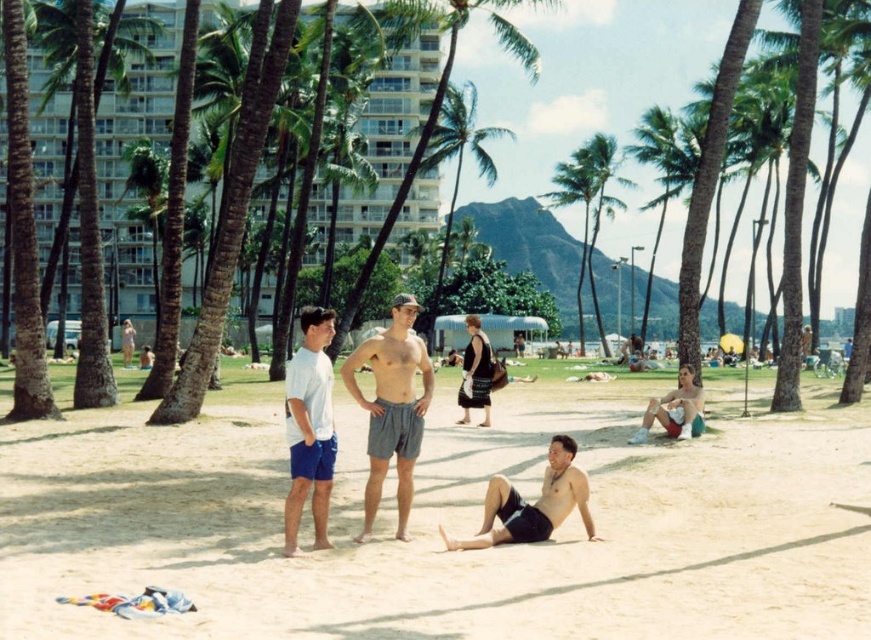
Question: Can you confirm if light brown sand at center is positioned below matte black shorts at lower center?

Choices:
 (A) yes
 (B) no

Answer: (A)

Question: Can you confirm if green leafy palm tree at center is positioned to the left of beige shorts at lower right?

Choices:
 (A) no
 (B) yes

Answer: (A)

Question: Estimate the real-world distances between objects in this image. Which object is farther from the matte black shorts at lower center?

Choices:
 (A) green leafy palm tree at center
 (B) beige shorts at lower right
 (C) gray cotton shorts at center
 (D) white cotton t-shirt at center

Answer: (A)

Question: Which point is closer to the camera?

Choices:
 (A) light brown sand at center
 (B) white cotton t-shirt at center

Answer: (A)

Question: Does white cotton t-shirt at center appear over matte black shorts at lower center?

Choices:
 (A) yes
 (B) no

Answer: (A)

Question: Considering the real-world distances, which object is farthest from the white cotton t-shirt at center?

Choices:
 (A) beige shorts at lower right
 (B) green leafy palm tree at center

Answer: (B)